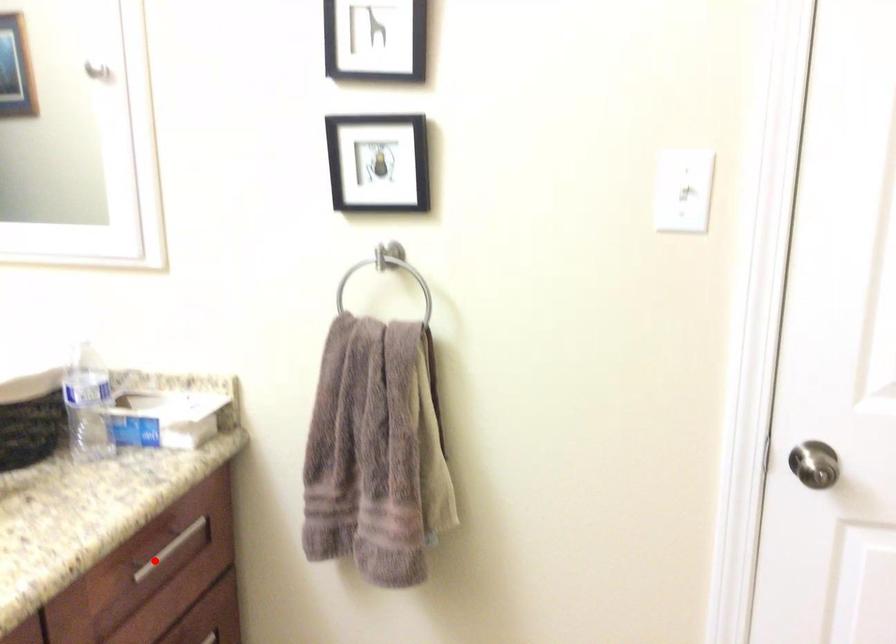
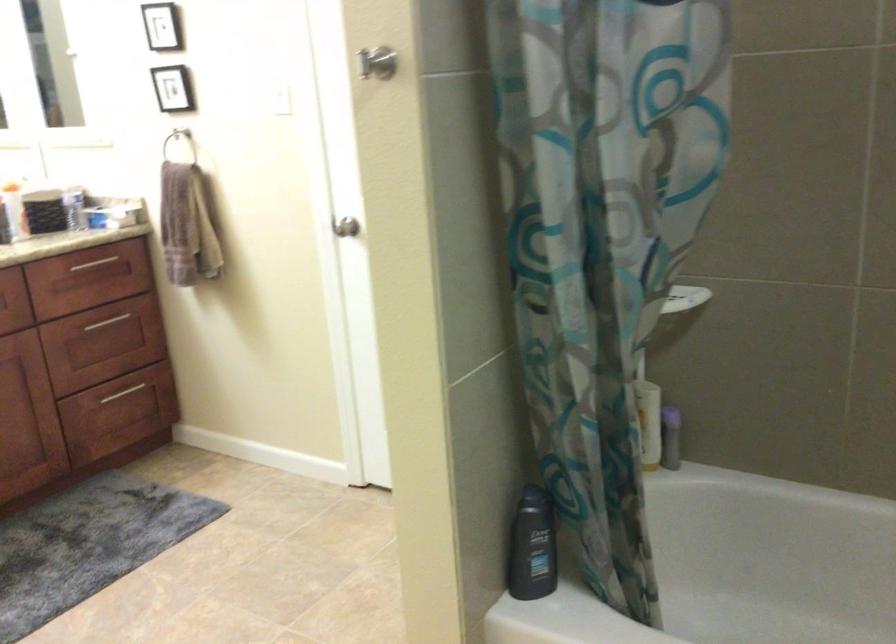
Question: I am providing you with two images of the same scene from different viewpoints. Given a red point in image1, look at the same physical point in image2. Is it:

Choices:
 (A) Closer to the viewpoint
 (B) Farther from the viewpoint

Answer: (B)